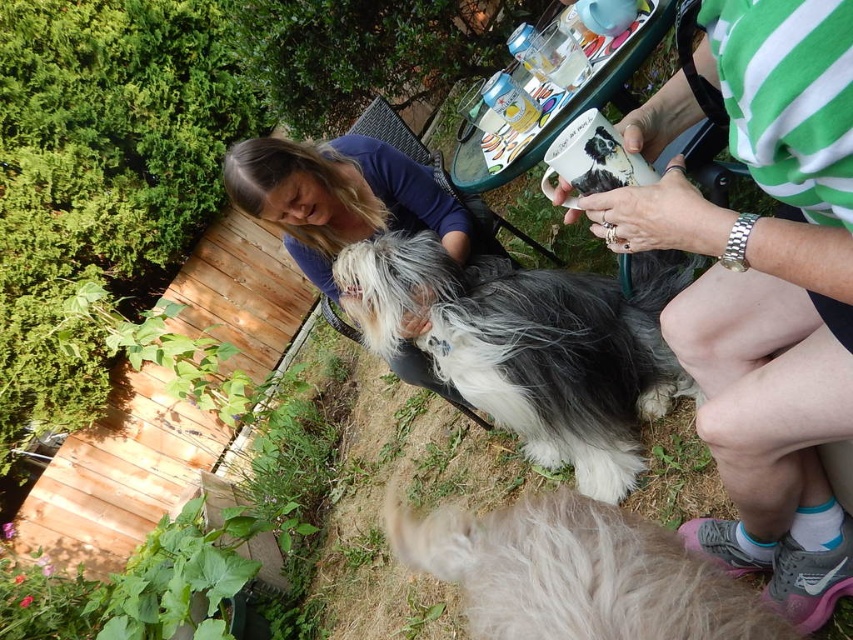
You are standing at the point with coordinates point (245, 157) and want to walk towards the wooden deck in the background. Is the point with coordinates point (616, 531) in your path?

Yes, the point with coordinates point (616, 531) is in your path because it is in front of point (245, 157).